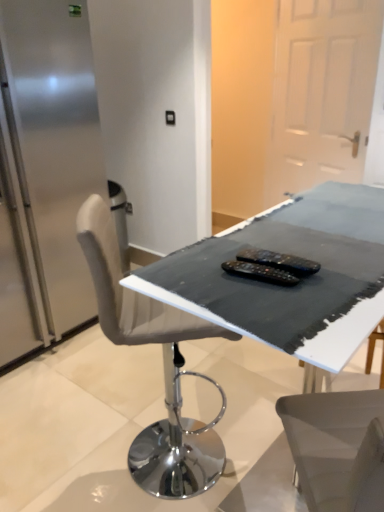
Question: Is black plastic remote controls at center, acting as the 1th equipment starting from the bottom, in front of or behind black fabric-covered table at center in the image?

Choices:
 (A) behind
 (B) front

Answer: (A)

Question: Looking at their shapes, would you say black plastic remote controls at center, acting as the 1th equipment starting from the bottom, is wider or thinner than black fabric-covered table at center?

Choices:
 (A) wide
 (B) thin

Answer: (B)

Question: Based on their relative distances, which object is nearer to the black plastic remote controls at center, arranged as the 2th equipment when viewed from the top?

Choices:
 (A) satin silver fridge at left
 (B) white matte door at upper right
 (C) black fabric-covered table at center
 (D) black plastic remote controls at center, the second equipment ordered from the bottom

Answer: (D)

Question: Considering the real-world distances, which object is closest to the white matte door at upper right?

Choices:
 (A) black plastic remote controls at center, the second equipment ordered from the bottom
 (B) black fabric-covered table at center
 (C) black plastic remote controls at center, arranged as the 2th equipment when viewed from the top
 (D) satin silver fridge at left

Answer: (D)